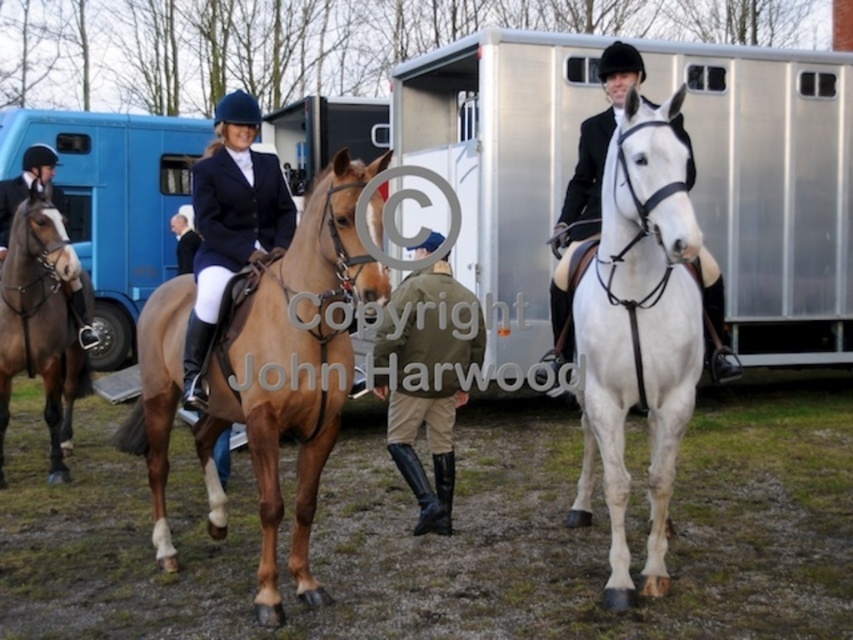
Question: Is brown glossy horse at left below khaki fabric jacket at center?

Choices:
 (A) no
 (B) yes

Answer: (B)

Question: Among these objects, which one is nearest to the camera?

Choices:
 (A) white glossy horse at center
 (B) khaki fabric jacket at center
 (C) brown glossy horse at center
 (D) navy blue fabric jacket at center

Answer: (C)

Question: Which of these objects is positioned farthest from the white leather horse at right?

Choices:
 (A) navy blue fabric jacket at center
 (B) white glossy horse at center
 (C) khaki fabric jacket at center

Answer: (A)

Question: Which point is closer to the camera taking this photo?

Choices:
 (A) (646, 134)
 (B) (154, 433)
 (C) (49, 262)
 (D) (227, 97)

Answer: (A)

Question: Is brown glossy horse at left closer to camera compared to white glossy horse at center?

Choices:
 (A) yes
 (B) no

Answer: (B)

Question: Is white leather horse at right positioned in front of white glossy horse at center?

Choices:
 (A) no
 (B) yes

Answer: (B)